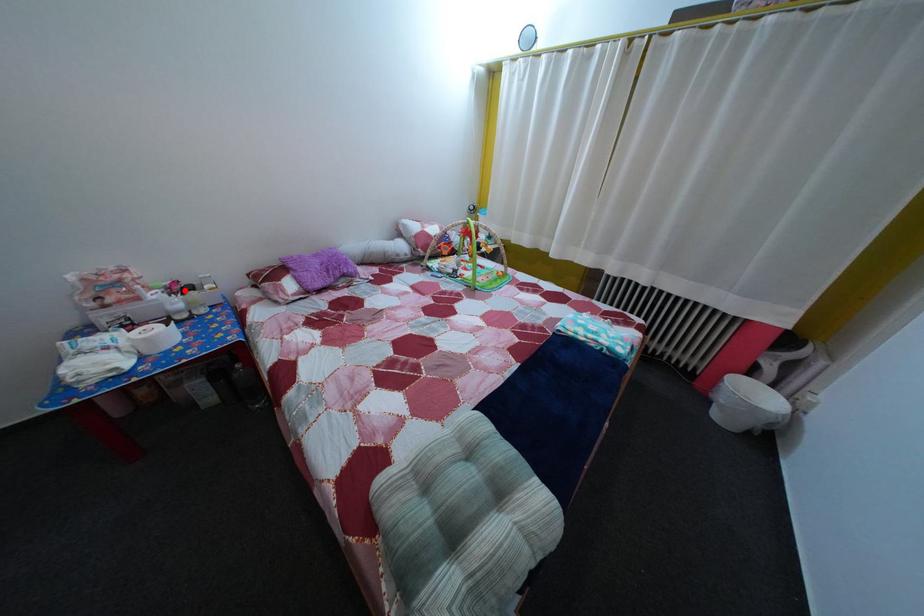
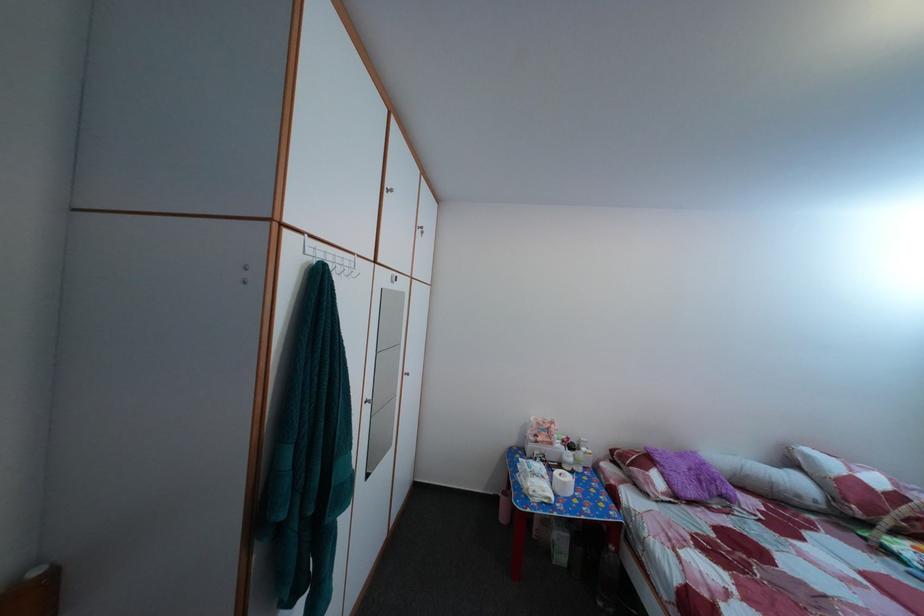
Question: I am providing you with two images of the same scene from different viewpoints. In image1, a red point is highlighted. Considering the same 3D point in image2, which of the following is correct?

Choices:
 (A) It is closer
 (B) It is farther

Answer: (B)